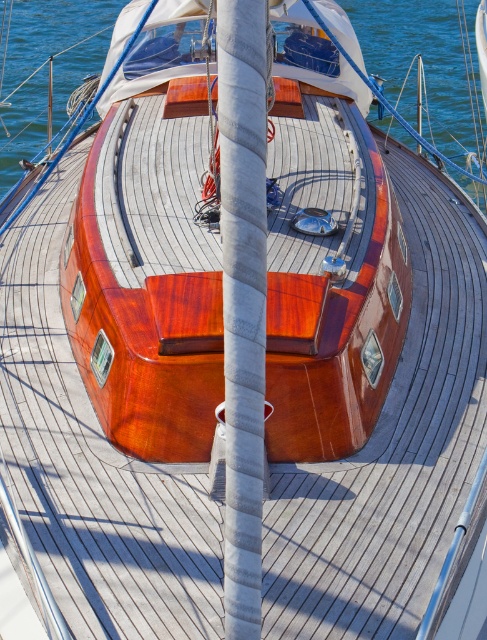
You are on the deck of the sailboat and want to reach the transparent blue water at center. Which direction should you move relative to the white textured mast at center?

The white textured mast at center is located below the transparent blue water at center, so you should move downward towards the transparent blue water at center to reach it.